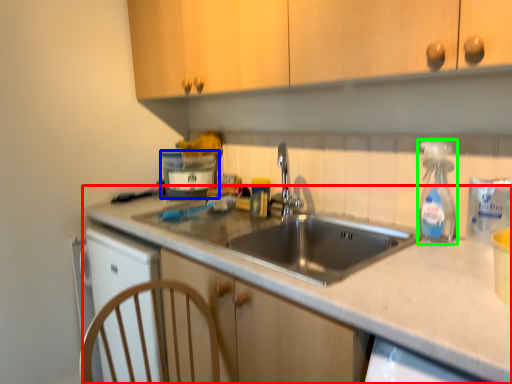
Question: Based on their relative distances, which object is farther from countertop (highlighted by a red box)? Choose from appliance (highlighted by a blue box) and soap dispenser (highlighted by a green box).

Choices:
 (A) appliance
 (B) soap dispenser

Answer: (A)